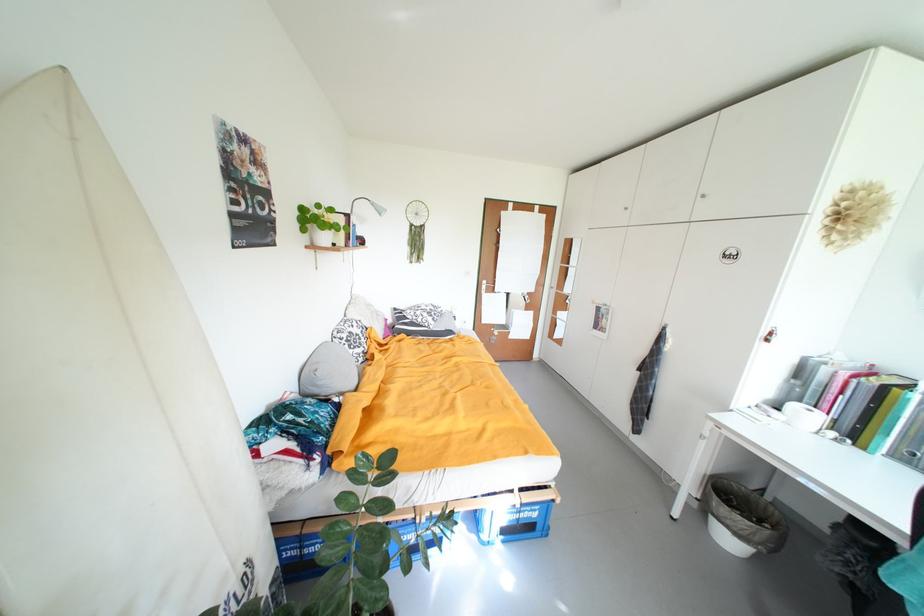
Which object does [743,519] point to?

It refers to a white trash can.